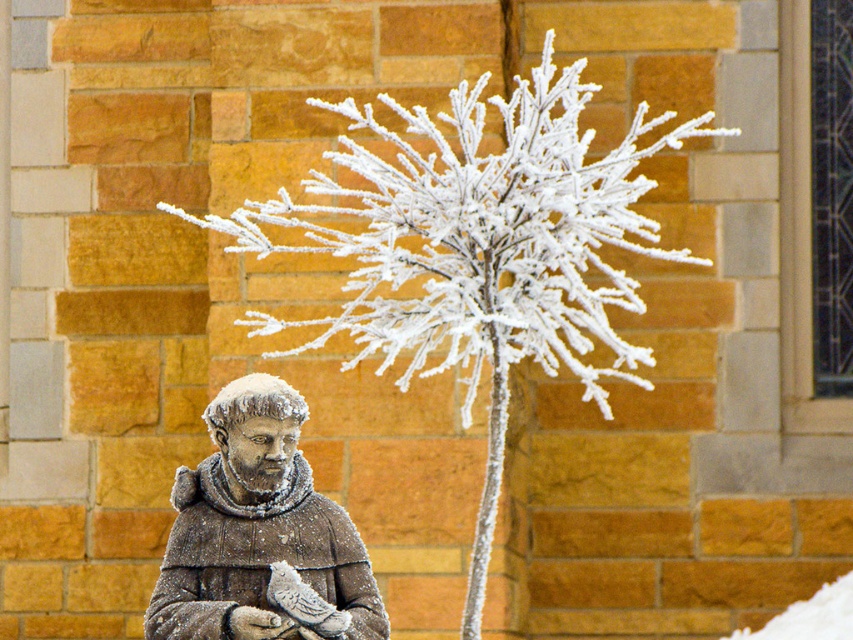
You are an artist planning to sketch the scene. You need to know the relative positions of the frosted white branches at center and the frosted stone statue at lower left. Which object is positioned to the right side of the other?

The frosted white branches at center are to the right of the frosted stone statue at lower left.

You are an artist planning to sketch the scene. You notice the frosted white branches at center and the frosted stone statue at lower left. Which object should you draw first if you want to capture the larger one first?

The frosted white branches at center should be drawn first because they are larger than the frosted stone statue at lower left according to the description.

You are an artist standing in front of the scene. You want to sketch the frosted white branches at center and the frosted stone statue at lower left. Which object should you draw first to maintain the correct spatial relationship between them?

You should draw the frosted white branches at center first because it is closer to you than the frosted stone statue at lower left, so it should be depicted in front of the statue to maintain the correct spatial relationship.